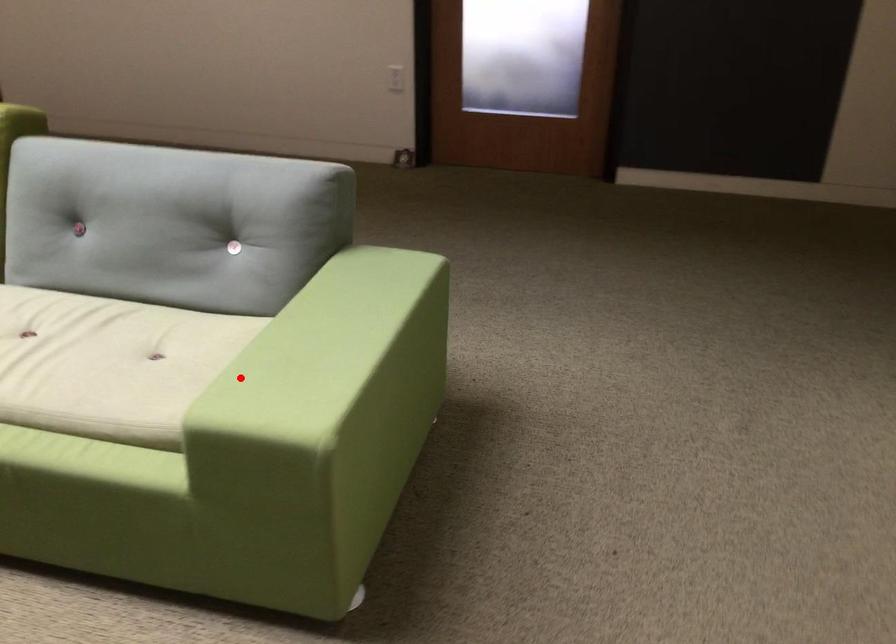
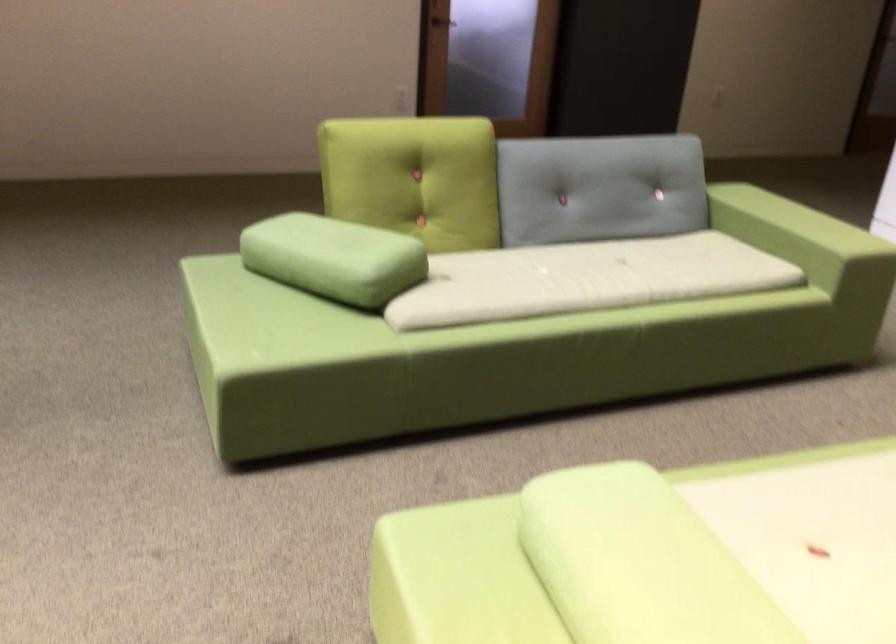
Question: A red point is marked in image1. In image2, is the corresponding 3D point closer to the camera or farther? Reply with the corresponding letter.

Choices:
 (A) The corresponding 3D point is closer.
 (B) The corresponding 3D point is farther.

Answer: (B)